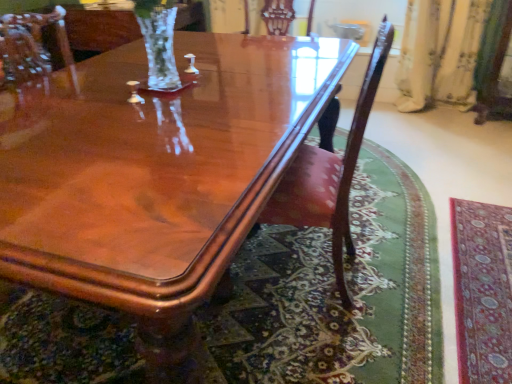
Question: Is glossy wood coffee table at center at the back of mahogany wood chair at center?

Choices:
 (A) yes
 (B) no

Answer: (A)

Question: Is mahogany wood chair at center not within glossy wood coffee table at center?

Choices:
 (A) no
 (B) yes

Answer: (A)

Question: Considering the relative sizes of mahogany wood chair at center and glossy wood coffee table at center in the image provided, is mahogany wood chair at center smaller than glossy wood coffee table at center?

Choices:
 (A) no
 (B) yes

Answer: (B)

Question: Does mahogany wood chair at center have a lesser height compared to glossy wood coffee table at center?

Choices:
 (A) no
 (B) yes

Answer: (A)

Question: Is glossy wood coffee table at center located within mahogany wood chair at center?

Choices:
 (A) no
 (B) yes

Answer: (A)

Question: Is carpet with intricate patterns at lower right taller or shorter than mahogany wood chair at center?

Choices:
 (A) short
 (B) tall

Answer: (A)

Question: From the image's perspective, is carpet with intricate patterns at lower right located above or below mahogany wood chair at center?

Choices:
 (A) below
 (B) above

Answer: (A)

Question: Looking at their shapes, would you say carpet with intricate patterns at lower right is wider or thinner than mahogany wood chair at center?

Choices:
 (A) thin
 (B) wide

Answer: (A)

Question: Looking at the image, does carpet with intricate patterns at lower right seem bigger or smaller compared to mahogany wood chair at center?

Choices:
 (A) big
 (B) small

Answer: (B)

Question: From the image's perspective, is mahogany wood chair at center above or below carpet with intricate patterns at lower right?

Choices:
 (A) above
 (B) below

Answer: (A)

Question: Considering the positions of point (282, 206) and point (506, 240), is point (282, 206) closer or farther from the camera than point (506, 240)?

Choices:
 (A) closer
 (B) farther

Answer: (A)

Question: Relative to carpet with intricate patterns at lower right, is mahogany wood chair at center in front or behind?

Choices:
 (A) behind
 (B) front

Answer: (B)

Question: Is mahogany wood chair at center situated inside carpet with intricate patterns at lower right or outside?

Choices:
 (A) outside
 (B) inside

Answer: (A)

Question: Relative to carpet with intricate patterns at lower right, is glossy wood coffee table at center in front or behind?

Choices:
 (A) front
 (B) behind

Answer: (A)

Question: From a real-world perspective, is glossy wood coffee table at center physically located above or below carpet with intricate patterns at lower right?

Choices:
 (A) above
 (B) below

Answer: (A)